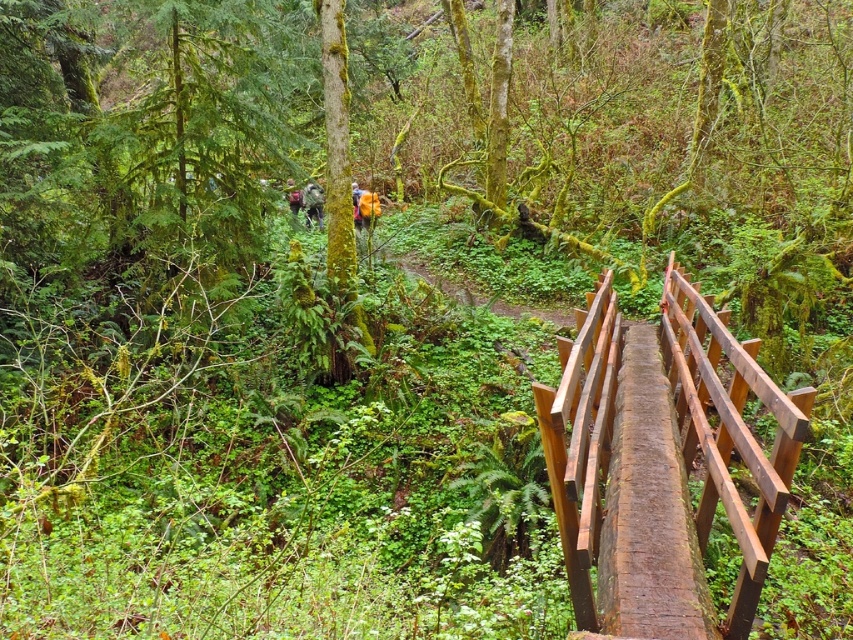
Describe the element at coordinates (728, 429) in the screenshot. This screenshot has width=853, height=640. I see `brown wooden rail at upper right` at that location.

Is point (672, 266) farther from viewer compared to point (294, 198)?

No, (672, 266) is closer to viewer.

The height and width of the screenshot is (640, 853). What do you see at coordinates (728, 429) in the screenshot? I see `brown wooden rail at upper right` at bounding box center [728, 429].

Identify the location of brown wooden rail at upper right. (728, 429).

Who is shorter, camouflage fabric backpack at center or camouflage backpack at center?

camouflage backpack at center

Is camouflage fabric backpack at center closer to the viewer compared to camouflage backpack at center?

No, camouflage fabric backpack at center is behind camouflage backpack at center.

Where is `camouflage fabric backpack at center`? camouflage fabric backpack at center is located at coordinates (312, 202).

Does brown wooden rail at upper right appear over camouflage fabric backpack at center?

No.

Is the position of brown wooden rail at upper right more distant than that of camouflage fabric backpack at center?

No, it is not.

Which is behind, point (567, 376) or point (312, 180)?

Point (312, 180)

Identify the location of brown wooden rail at upper right. The width and height of the screenshot is (853, 640). (728, 429).